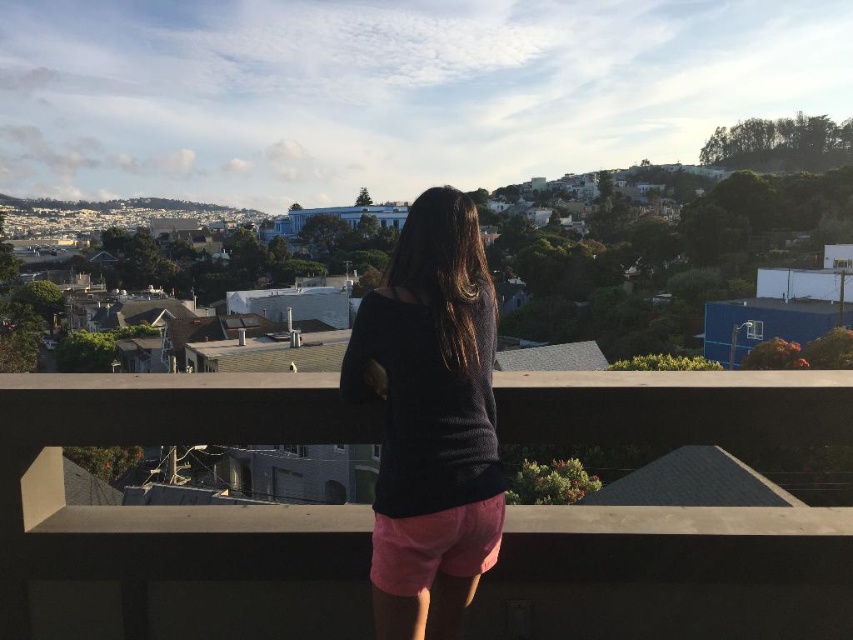
Between point (664, 515) and point (415, 570), which one is positioned in front?

Positioned in front is point (415, 570).

Between concrete at center and dark gray sweater at center, which one appears on the left side from the viewer's perspective?

concrete at center

Describe the element at coordinates (173, 516) in the screenshot. I see `concrete at center` at that location.

What are the coordinates of `concrete at center` in the screenshot? It's located at (173, 516).